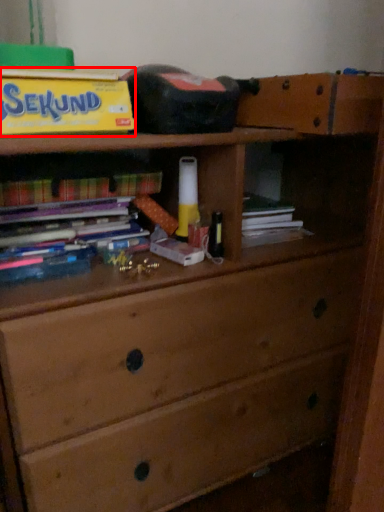
Question: From the image's perspective, where is paperback book (annotated by the red box) located in relation to book in the image?

Choices:
 (A) above
 (B) below

Answer: (A)